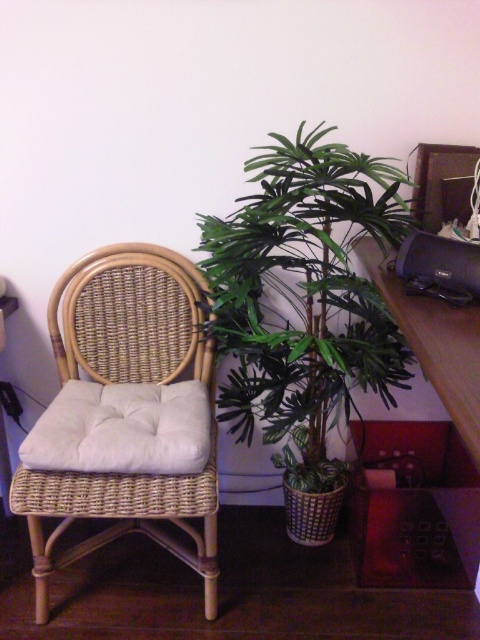
You are standing in the room and want to water the green leafy plant at center. If your watering can has a maximum reach of 4 feet, can you water it without moving closer?

The green leafy plant at center is 4.46 feet away from the viewer. Since the watering can only reaches up to 4 feet, you cannot water it without moving closer.

You are trying to move the woven rattan swivel chair at left closer to the green leafy plant at center. Based on their sizes, do you think there is enough space between them to maneuver the chair without hitting the plant?

The green leafy plant at center might be wider than the woven rattan swivel chair at left, so there may not be enough space to move the chair closer without potentially hitting the plant.